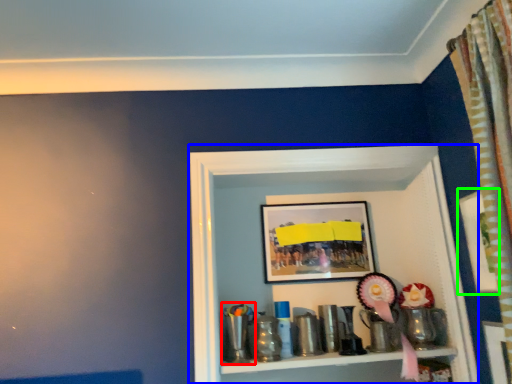
Question: Which is farther away from toy (highlighted by a red box)? shelf (highlighted by a blue box) or picture frame (highlighted by a green box)?

Choices:
 (A) shelf
 (B) picture frame

Answer: (B)